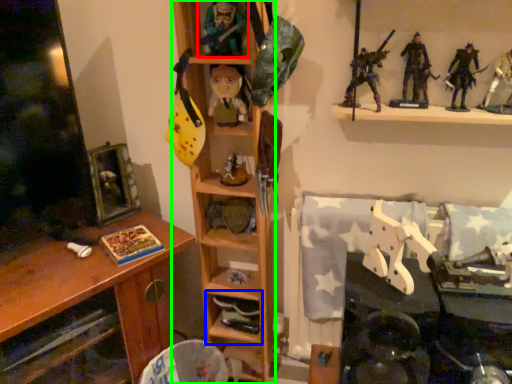
Question: Based on their relative distances, which object is nearer to toy (highlighted by a red box)? Choose from shelf (highlighted by a blue box) and shelf (highlighted by a green box).

Choices:
 (A) shelf
 (B) shelf

Answer: (B)